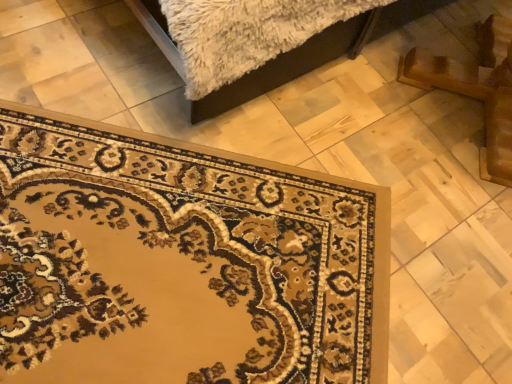
Describe the element at coordinates (182, 262) in the screenshot. I see `carpet with intricate patterns at lower left` at that location.

In order to click on carpet with intricate patterns at lower left in this screenshot , I will do `click(182, 262)`.

In order to click on carpet with intricate patterns at lower left in this screenshot , I will do `click(182, 262)`.